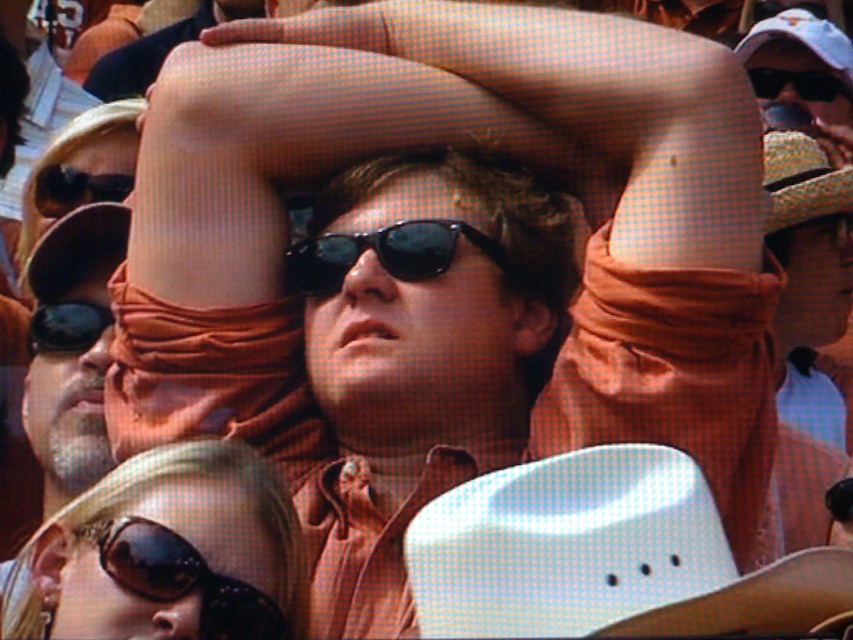
You are a photographer standing at the camera position. You want to capture a closeup of the white matte cowboy hat at upper center. Given that the camera and the hat are 49.64 meters apart, is this distance within the recommended 50 meter maximum range for your camera to focus clearly?

The white matte cowboy hat at upper center and camera are 49.64 meters apart. Since the distance is just under the 50 meter maximum range, the camera should be able to focus clearly on the white matte cowboy hat at upper center.

You are at an outdoor event and see two pairs of sunglasses. One is sunglasses at lower left and the other is black plastic sunglasses at upper center. Which pair is positioned to the left?

The sunglasses at lower left is positioned to the left of the black plastic sunglasses at upper center.